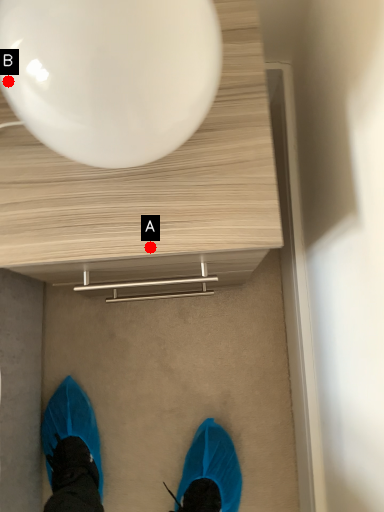
Question: Two points are circled on the image, labeled by A and B beside each circle. Which point is farther from the camera taking this photo?

Choices:
 (A) A is further
 (B) B is further

Answer: (A)